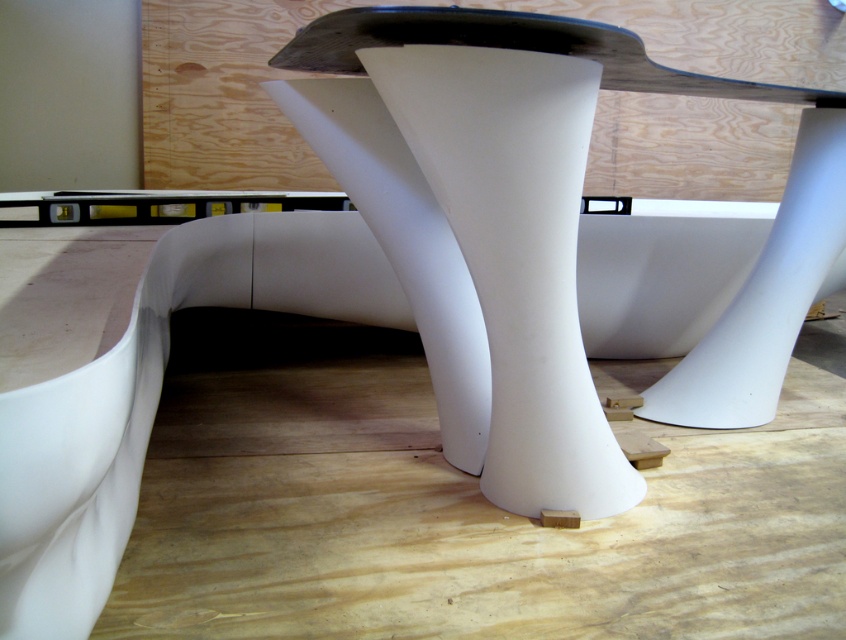
Question: Can you confirm if white glossy table at center is positioned to the left of white matte/soft plastic pillar at center?

Choices:
 (A) no
 (B) yes

Answer: (A)

Question: Is white glossy table at center thinner than white matte/soft plastic pillar at center?

Choices:
 (A) yes
 (B) no

Answer: (B)

Question: Which point is closer to the camera?

Choices:
 (A) (762, 317)
 (B) (536, 394)

Answer: (B)

Question: Among these points, which one is farthest from the camera?

Choices:
 (A) (567, 58)
 (B) (519, 173)

Answer: (B)

Question: Is white glossy table at center wider than white matte/soft plastic pillar at center?

Choices:
 (A) no
 (B) yes

Answer: (B)